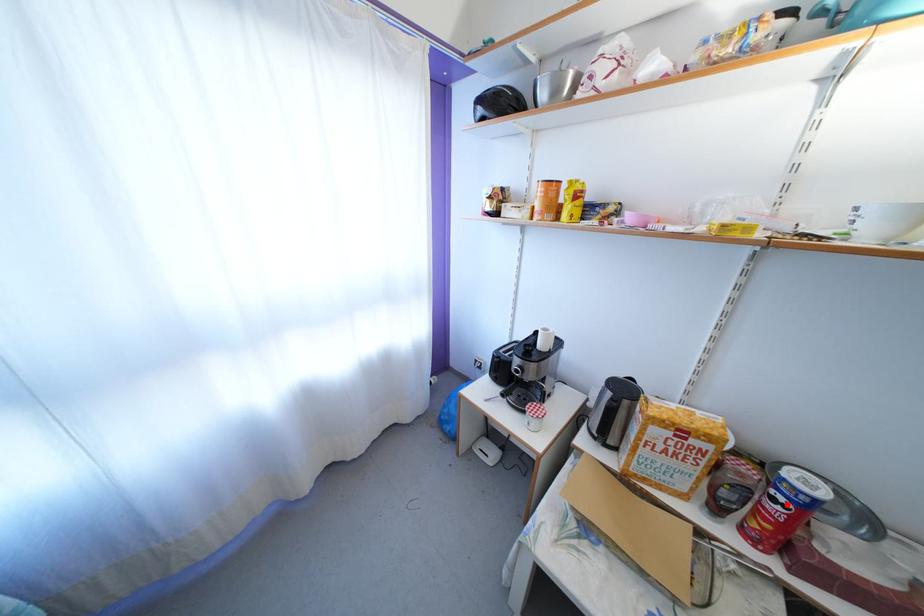
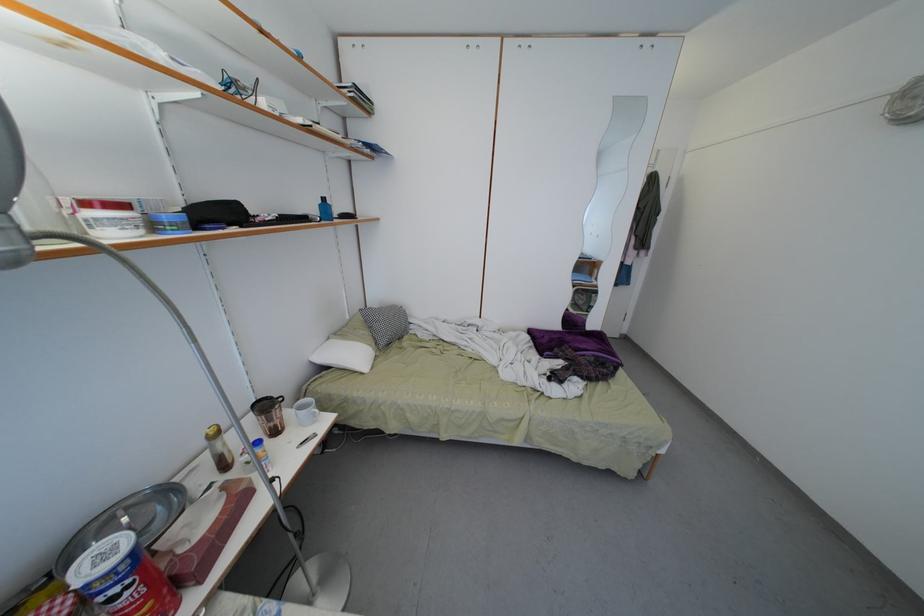
In the second image, find the point that corresponds to the highlighted location in the first image.

(120, 596)